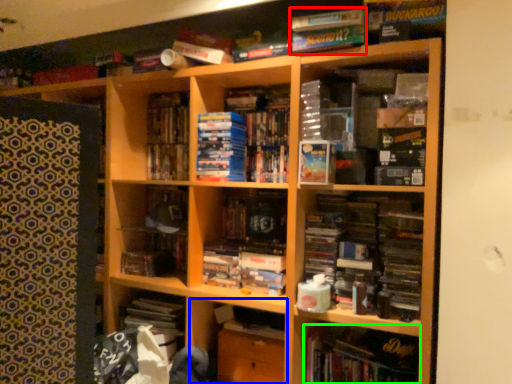
Question: Which object is the closest to the book (highlighted by a red box)? Choose among these: cabinet (highlighted by a blue box) or book (highlighted by a green box).

Choices:
 (A) cabinet
 (B) book

Answer: (B)